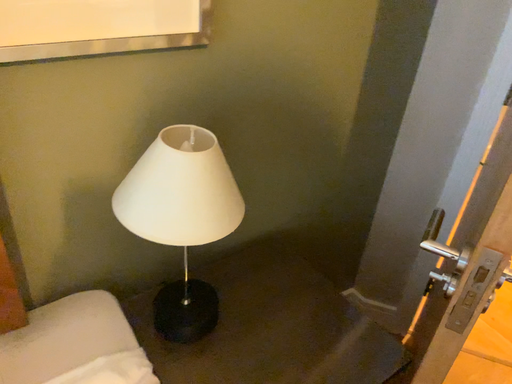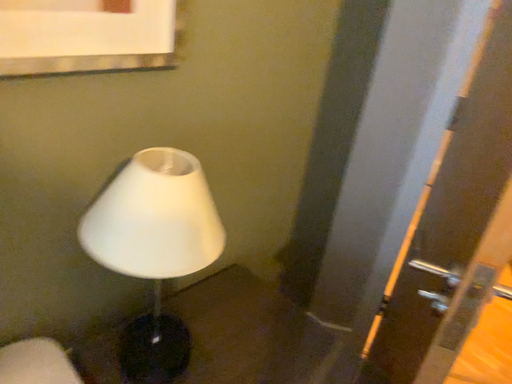
Question: Which way did the camera rotate in the video?

Choices:
 (A) rotated left
 (B) rotated right

Answer: (B)